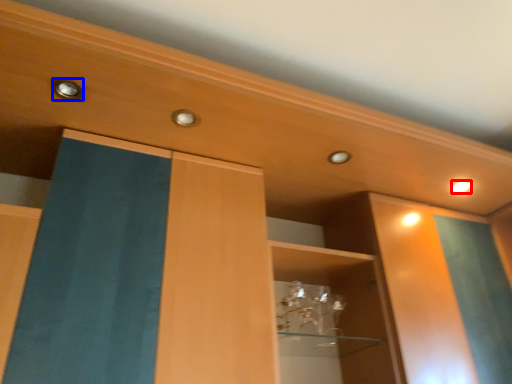
Question: Which object appears farthest to the camera in this image, lighting (highlighted by a red box) or knob (highlighted by a blue box)?

Choices:
 (A) lighting
 (B) knob

Answer: (A)